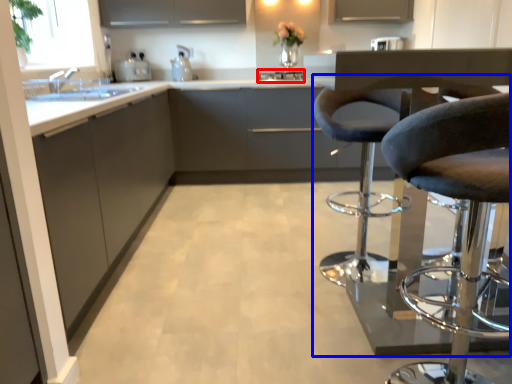
Question: Among these objects, which one is farthest to the camera, appliance (highlighted by a red box) or chair (highlighted by a blue box)?

Choices:
 (A) appliance
 (B) chair

Answer: (A)